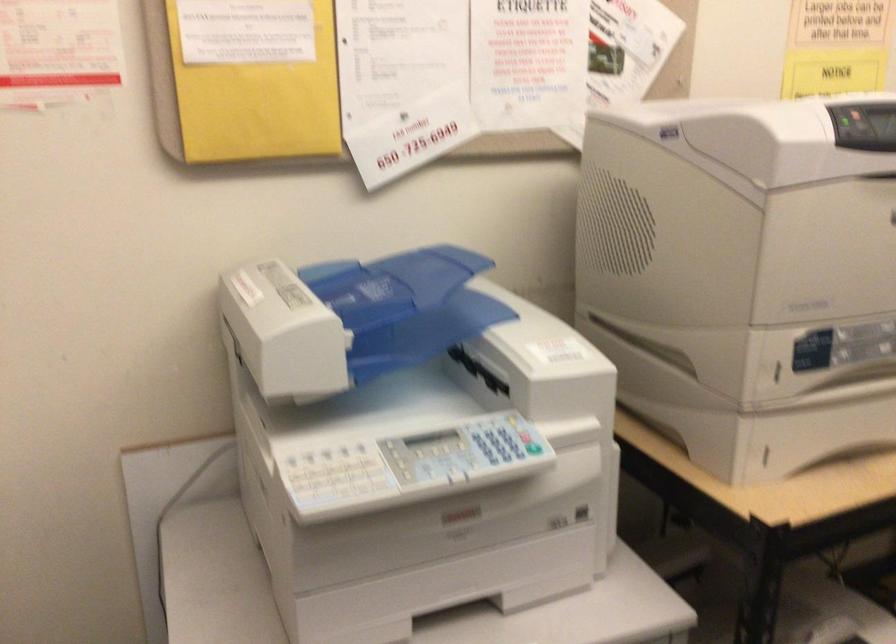
Where is `blue document feeder`? The width and height of the screenshot is (896, 644). blue document feeder is located at coordinates (392, 283).